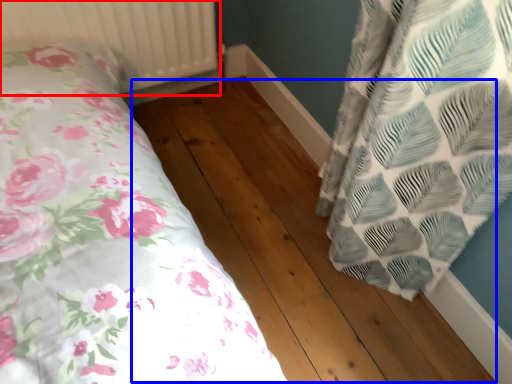
Question: Which point is further to the camera, radiator (highlighted by a red box) or hardwood (highlighted by a blue box)?

Choices:
 (A) radiator
 (B) hardwood

Answer: (A)